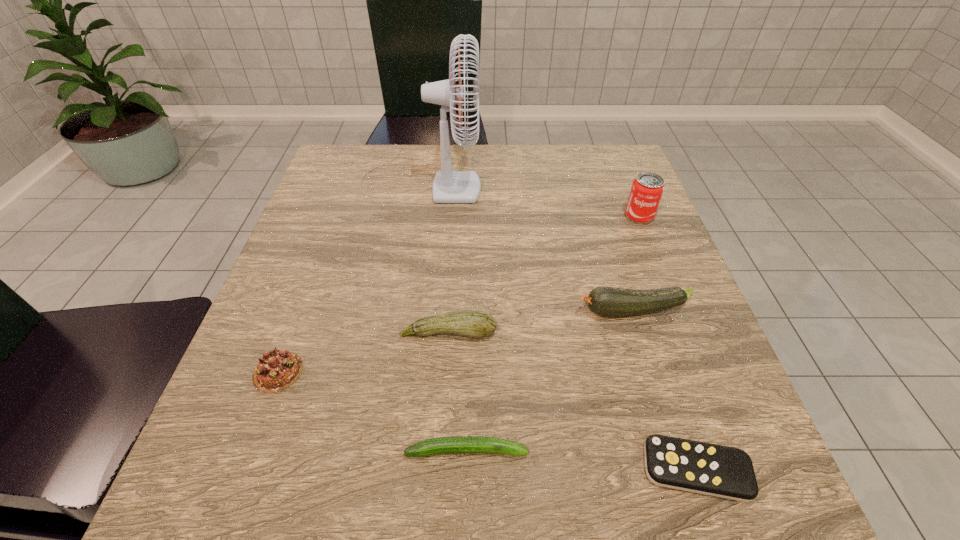
At what (x,y) coordinates should I click in order to perform the action: click on vacant area that satisfies the following two spatial constraints: 1. at the blossom end of the rightmost zucchini; 2. on the front side of the fifth farthest object. Please return your answer as a coordinate pair (x, y). The image size is (960, 540). Looking at the image, I should click on (652, 372).